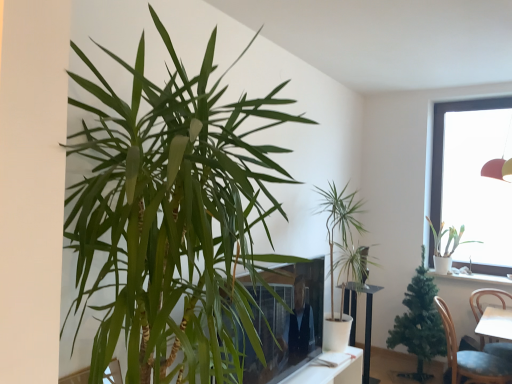
Question: Is green leafy plant at center, the third houseplant positioned from the back, with blue fabric chair at lower right?

Choices:
 (A) yes
 (B) no

Answer: (B)

Question: Is green leafy plant at center, the second houseplant from the left, outside blue fabric chair at lower right?

Choices:
 (A) no
 (B) yes

Answer: (B)

Question: From the image's perspective, is green leafy plant at center, the third houseplant positioned from the back, located beneath blue fabric chair at lower right?

Choices:
 (A) no
 (B) yes

Answer: (A)

Question: Is green leafy plant at center, the 3th houseplant in the right-to-left sequence, behind blue fabric chair at lower right?

Choices:
 (A) yes
 (B) no

Answer: (A)

Question: Can you confirm if green leafy plant at center, the 3th houseplant in the right-to-left sequence, is wider than blue fabric chair at lower right?

Choices:
 (A) yes
 (B) no

Answer: (B)

Question: Based on their sizes in the image, would you say green leafy plant at center, the third houseplant positioned from the back, is bigger or smaller than white ceramic pot at upper right?

Choices:
 (A) small
 (B) big

Answer: (B)

Question: Visually, is green leafy plant at center, the third houseplant positioned from the back, positioned to the left or to the right of white ceramic pot at upper right?

Choices:
 (A) right
 (B) left

Answer: (B)

Question: Considering the positions of point (339, 309) and point (467, 279), is point (339, 309) closer or farther from the camera than point (467, 279)?

Choices:
 (A) closer
 (B) farther

Answer: (A)

Question: In terms of height, does green leafy plant at center, the third houseplant positioned from the back, look taller or shorter compared to white ceramic pot at upper right?

Choices:
 (A) short
 (B) tall

Answer: (B)

Question: Considering the positions of green leafy plant at left, the first houseplant when ordered from left to right, and transparent glass window at upper right in the image, is green leafy plant at left, the first houseplant when ordered from left to right, wider or thinner than transparent glass window at upper right?

Choices:
 (A) wide
 (B) thin

Answer: (A)

Question: From the image's perspective, is green leafy plant at left, the first houseplant when ordered from left to right, located above or below transparent glass window at upper right?

Choices:
 (A) below
 (B) above

Answer: (A)

Question: In the image, is green leafy plant at left, which is the fourth houseplant in right-to-left order, on the left side or the right side of transparent glass window at upper right?

Choices:
 (A) right
 (B) left

Answer: (B)

Question: Does point (284, 177) appear closer or farther from the camera than point (448, 104)?

Choices:
 (A) closer
 (B) farther

Answer: (A)

Question: Is white ceramic pot at upper right inside the boundaries of green leafy plant at center, the second houseplant from the left, or outside?

Choices:
 (A) inside
 (B) outside

Answer: (B)

Question: From the image's perspective, is white ceramic pot at upper right located above or below green leafy plant at center, the third houseplant positioned from the back?

Choices:
 (A) below
 (B) above

Answer: (A)